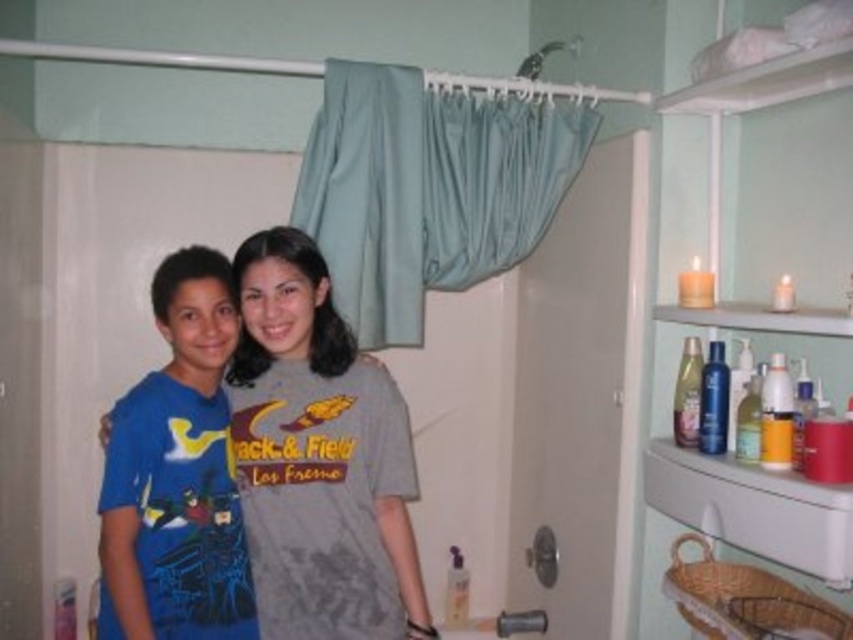
Between gray cotton t-shirt at center and blue cotton shirt at left, which one is positioned higher?

Positioned higher is blue cotton shirt at left.

Which is more to the left, gray cotton t-shirt at center or blue cotton shirt at left?

blue cotton shirt at left is more to the left.

Who is more distant from viewer, (335, 404) or (131, 580)?

Point (335, 404)

This screenshot has width=853, height=640. Find the location of `gray cotton t-shirt at center`. gray cotton t-shirt at center is located at coordinates (318, 458).

Which is in front, point (379, 476) or point (717, 461)?

Positioned in front is point (717, 461).

Can you confirm if gray cotton t-shirt at center is positioned below white plastic sink at lower right?

Actually, gray cotton t-shirt at center is above white plastic sink at lower right.

Does point (331, 522) lie behind point (695, 499)?

Yes, it is.

The width and height of the screenshot is (853, 640). Find the location of `gray cotton t-shirt at center`. gray cotton t-shirt at center is located at coordinates (318, 458).

From the picture: Measure the distance between point [152,380] and camera.

They are 5.44 feet apart.

Is blue cotton shirt at left wider than white plastic sink at lower right?

Yes, blue cotton shirt at left is wider than white plastic sink at lower right.

Is point (225, 576) positioned after point (669, 464)?

No, (225, 576) is in front of (669, 464).

Where is `blue cotton shirt at left`? blue cotton shirt at left is located at coordinates (177, 474).